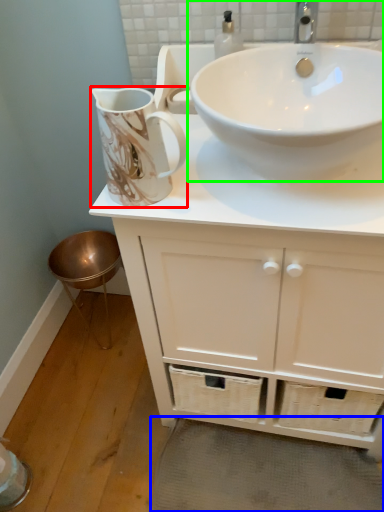
Question: Which object is the closest to the jug (highlighted by a red box)? Choose among these: bath mat (highlighted by a blue box) or sink (highlighted by a green box).

Choices:
 (A) bath mat
 (B) sink

Answer: (B)